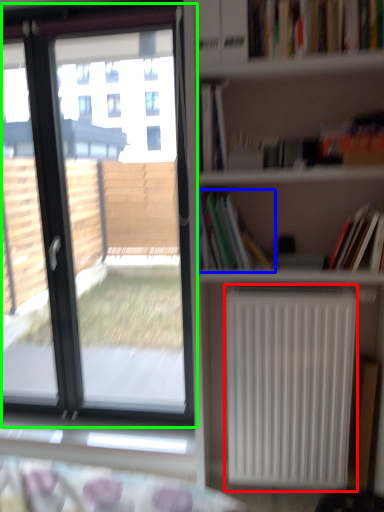
Question: Which is nearer to the radiator (highlighted by a red box)? book (highlighted by a blue box) or window (highlighted by a green box).

Choices:
 (A) book
 (B) window

Answer: (A)